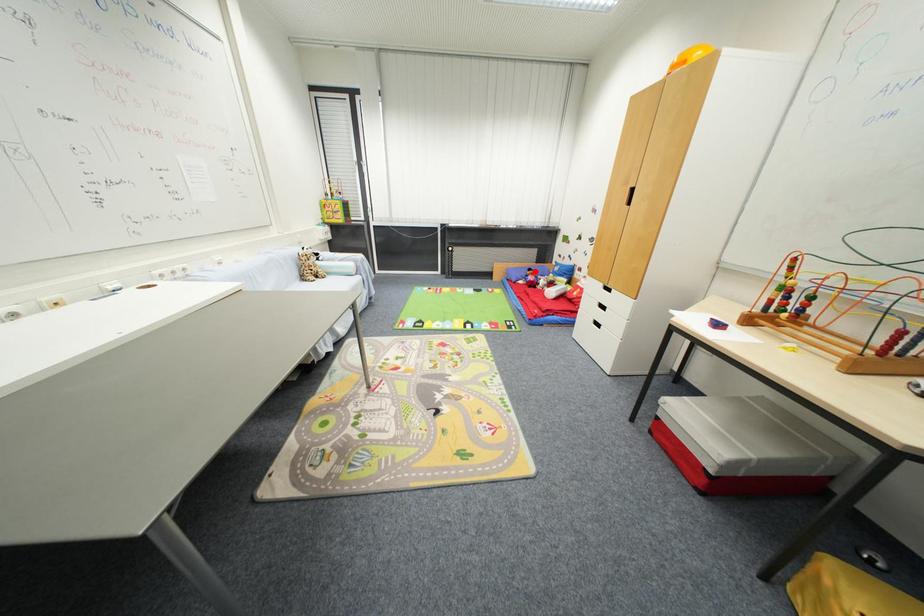
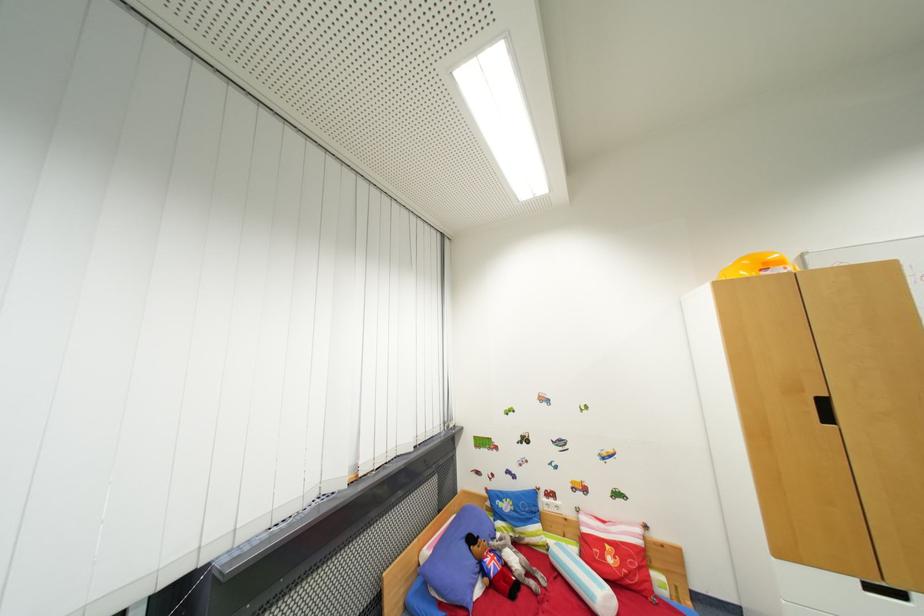
Question: I am providing you with two images of the same scene from different viewpoints. Given a red point in image1, look at the same physical point in image2. Is it:

Choices:
 (A) Closer to the viewpoint
 (B) Farther from the viewpoint

Answer: (B)